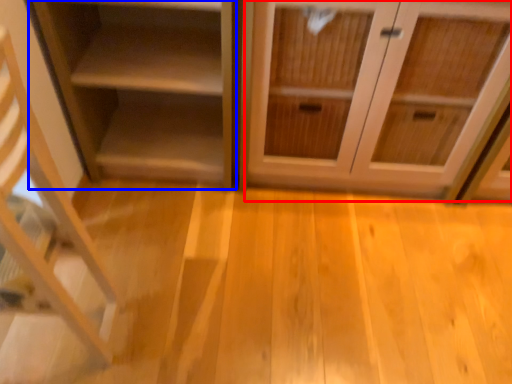
Question: Which point is further to the camera, cabinetry (highlighted by a red box) or shelf (highlighted by a blue box)?

Choices:
 (A) cabinetry
 (B) shelf

Answer: (B)